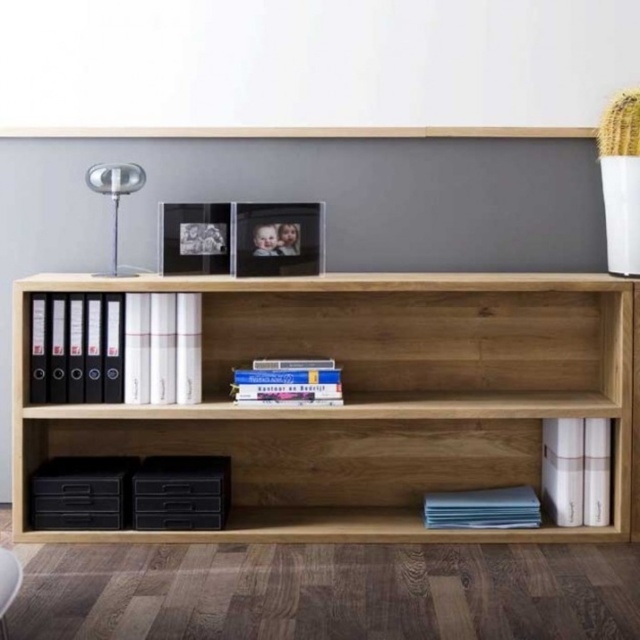
Question: Does natural wood shelf at center have a smaller size compared to white fabric armchair at lower left?

Choices:
 (A) yes
 (B) no

Answer: (B)

Question: Can you confirm if hardcover book at center is thinner than blue paper at lower right?

Choices:
 (A) yes
 (B) no

Answer: (A)

Question: Which of these objects is positioned closest to the natural wood shelf at center?

Choices:
 (A) black matte file folder at left
 (B) satin silver lamp at left
 (C) hardcover book at center
 (D) white matte book at lower right

Answer: (C)

Question: Estimate the real-world distances between objects in this image. Which object is closer to the hardcover book at center?

Choices:
 (A) satin silver lamp at left
 (B) black matte file folder at left
 (C) white matte book at lower right
 (D) natural wood shelf at center

Answer: (D)

Question: Observing the image, what is the correct spatial positioning of natural wood shelf at center in reference to white fabric armchair at lower left?

Choices:
 (A) below
 (B) above

Answer: (B)

Question: Which is farther from the hardcover book at center?

Choices:
 (A) natural wood shelf at center
 (B) black matte file folder at left
 (C) white matte book at lower right

Answer: (C)